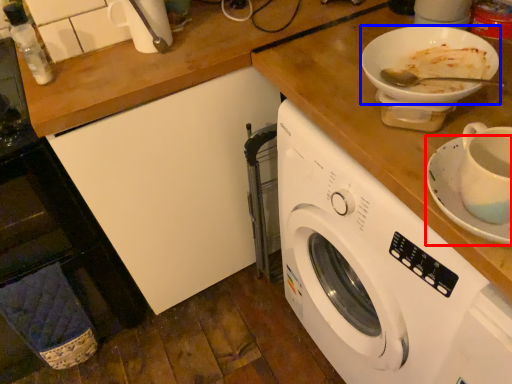
Question: Which object is closer to the camera taking this photo, saucer (highlighted by a red box) or tableware (highlighted by a blue box)?

Choices:
 (A) saucer
 (B) tableware

Answer: (A)